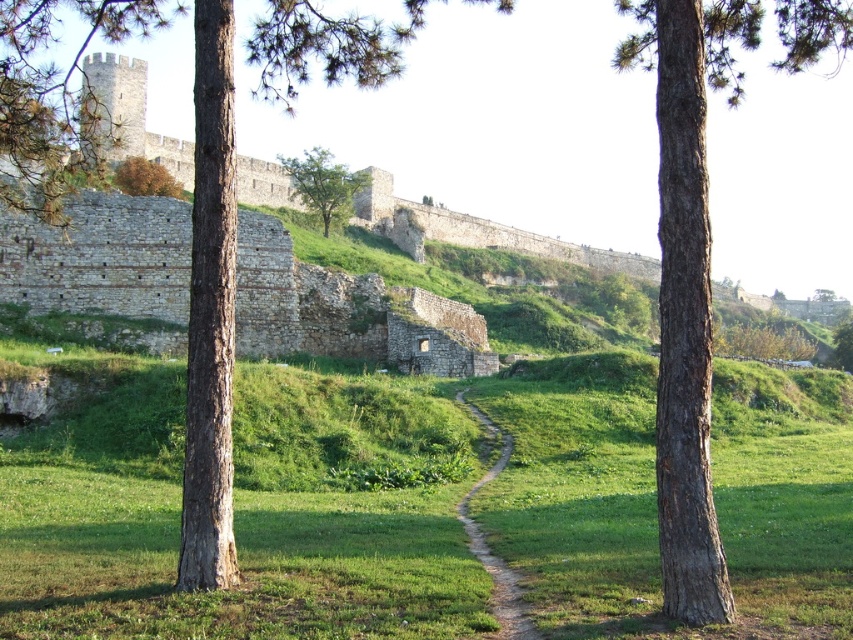
Which of these two, dirt path at center or green leafy tree at center, stands shorter?

dirt path at center

The height and width of the screenshot is (640, 853). Identify the location of dirt path at center. (489, 548).

Who is more distant from viewer, (489, 429) or (291, 182)?

Positioned behind is point (291, 182).

Identify the location of dirt path at center. The height and width of the screenshot is (640, 853). (489, 548).

Which is below, green grassy at center or dirt path at center?

dirt path at center

Looking at this image, is green grassy at center taller than dirt path at center?

Indeed, green grassy at center has a greater height compared to dirt path at center.

Is point (253, 381) positioned before point (497, 596)?

No, it is not.

I want to click on green grassy at center, so click(x=241, y=515).

Between brown rough bark tree at center and green leafy tree at center, which one has less height?

green leafy tree at center is shorter.

In the scene shown: How distant is brown rough bark tree at center from green leafy tree at center?

70.25 meters

Does point (334, 77) lie in front of point (344, 220)?

Yes, it is in front of point (344, 220).

At what (x,y) coordinates should I click in order to perform the action: click on brown rough bark tree at center. Please return your answer as a coordinate pair (x, y). Looking at the image, I should click on (210, 312).